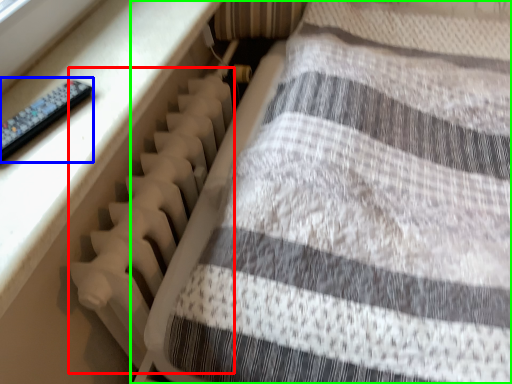
Question: Which is nearer to the radiator (highlighted by a red box)? control (highlighted by a blue box) or furniture (highlighted by a green box).

Choices:
 (A) control
 (B) furniture

Answer: (B)